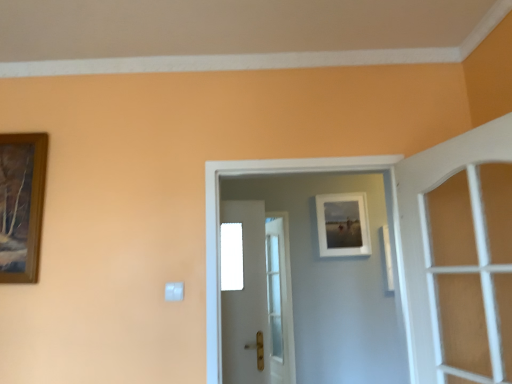
Question: From the image's perspective, would you say white glossy door at center, the 1th door in the back-to-front sequence, is shown under matte white picture frame at upper center?

Choices:
 (A) no
 (B) yes

Answer: (B)

Question: Is the position of white glossy door at center, which is the 3th door from front to back, more distant than that of matte white picture frame at upper center?

Choices:
 (A) yes
 (B) no

Answer: (B)

Question: From a real-world perspective, does white glossy door at center, the 1th door in the back-to-front sequence, stand above matte white picture frame at upper center?

Choices:
 (A) no
 (B) yes

Answer: (A)

Question: Does white glossy door at center, which is the 3th door from front to back, touch matte white picture frame at upper center?

Choices:
 (A) no
 (B) yes

Answer: (A)

Question: Is white glossy door at center, the 1th door in the back-to-front sequence, in front of matte white picture frame at upper center?

Choices:
 (A) no
 (B) yes

Answer: (B)

Question: Is white glossy door at center, which is the 3th door from front to back, wider than matte white picture frame at upper center?

Choices:
 (A) yes
 (B) no

Answer: (B)

Question: From the image's perspective, is white wooden door at right, which appears as the 3th door when viewed from the back, located above white glossy door at center, which is the 3th door from front to back?

Choices:
 (A) no
 (B) yes

Answer: (B)

Question: Can white glossy door at center, the 1th door in the back-to-front sequence, be found inside white wooden door at right, the first door positioned from the front?

Choices:
 (A) no
 (B) yes

Answer: (A)

Question: From a real-world perspective, is white wooden door at right, the first door positioned from the front, over white glossy door at center, which is the 3th door from front to back?

Choices:
 (A) yes
 (B) no

Answer: (A)

Question: Is white wooden door at right, the first door positioned from the front, facing towards white glossy door at center, the 1th door in the back-to-front sequence?

Choices:
 (A) no
 (B) yes

Answer: (A)

Question: Can you confirm if white wooden door at right, which appears as the 3th door when viewed from the back, is shorter than white glossy door at center, which is the 3th door from front to back?

Choices:
 (A) no
 (B) yes

Answer: (B)

Question: Is white wooden door at right, which appears as the 3th door when viewed from the back, wider than white glossy door at center, which is the 3th door from front to back?

Choices:
 (A) yes
 (B) no

Answer: (A)

Question: Is white plastic light switch at lower left facing away from white glossy door at center, which appears as the second door when viewed from the front?

Choices:
 (A) yes
 (B) no

Answer: (B)